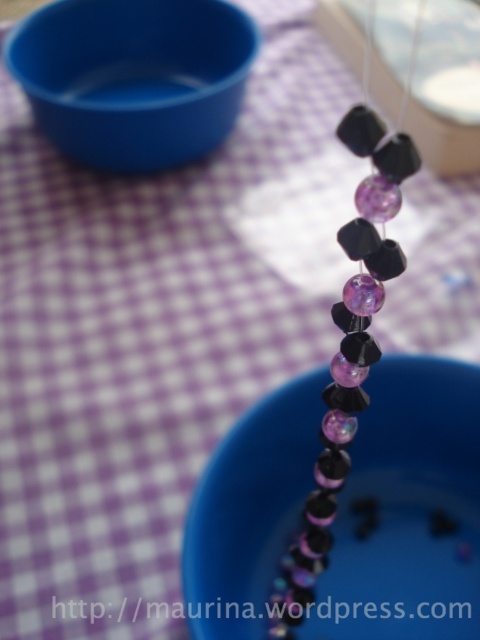
Locate an element on the screen. The height and width of the screenshot is (640, 480). blue plastic bowl at upper left is located at coordinates (133, 76).

Does blue plastic bowl at upper left have a greater width compared to translucent glass beads at center?

Correct, the width of blue plastic bowl at upper left exceeds that of translucent glass beads at center.

Image resolution: width=480 pixels, height=640 pixels. What do you see at coordinates (133, 76) in the screenshot?
I see `blue plastic bowl at upper left` at bounding box center [133, 76].

In order to click on blue plastic bowl at upper left in this screenshot , I will do [133, 76].